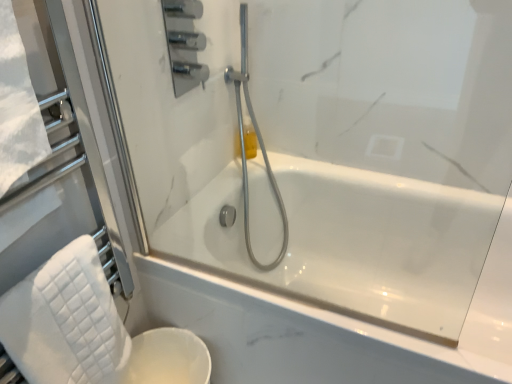
Question: Considering the positions of point (283, 231) and point (23, 288), is point (283, 231) closer or farther from the camera than point (23, 288)?

Choices:
 (A) farther
 (B) closer

Answer: (A)

Question: In the image, is satin chrome shower head at center positioned in front of or behind white quilted towel at lower left?

Choices:
 (A) front
 (B) behind

Answer: (B)

Question: Which object is positioned closest to the white glossy toilet bowl at lower left?

Choices:
 (A) satin chrome shower head at center
 (B) white quilted towel at lower left
 (C) translucent yellow bottle at upper center

Answer: (B)

Question: Estimate the real-world distances between objects in this image. Which object is closer to the white glossy toilet bowl at lower left?

Choices:
 (A) white quilted towel at lower left
 (B) translucent yellow bottle at upper center
 (C) satin chrome shower head at center

Answer: (A)